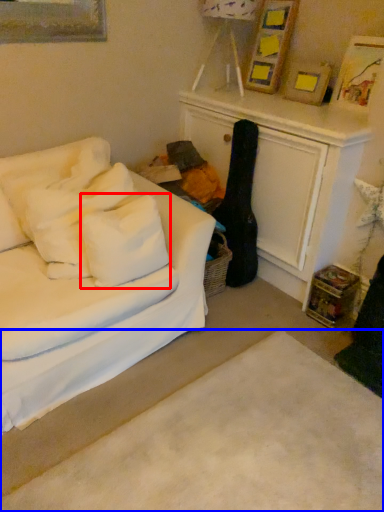
Question: Among these objects, which one is farthest to the camera, pillow (highlighted by a red box) or plain (highlighted by a blue box)?

Choices:
 (A) pillow
 (B) plain

Answer: (A)